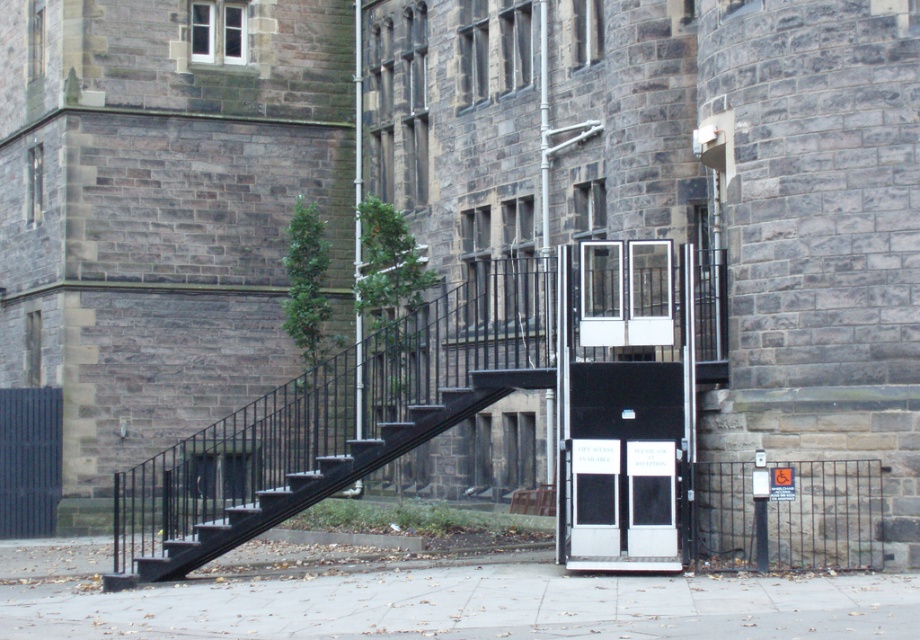
You are a person in a wheelchair trying to enter the building. The smooth concrete pavement at center is the path leading to the black matte door at center. Do you think the path is level with the door or sloped downward towards the door?

The smooth concrete pavement at center has a lesser height compared to black matte door at center, so the path slopes downward towards the door, making it easier for the wheelchair to move towards the door.

You are standing at the entrance of the historic stone building and need to locate the point marked as point (472,605). According to the scene description, where would you find this point?

The point (472,605) is located on the smooth concrete pavement at center.

You are a visitor approaching the entrance of the building. You see the dark gray stone tower at left and the smooth concrete pavement at center. Which object is located to the left of the other?

The dark gray stone tower at left is positioned on the left side of smooth concrete pavement at center, so it is to the left of the pavement.